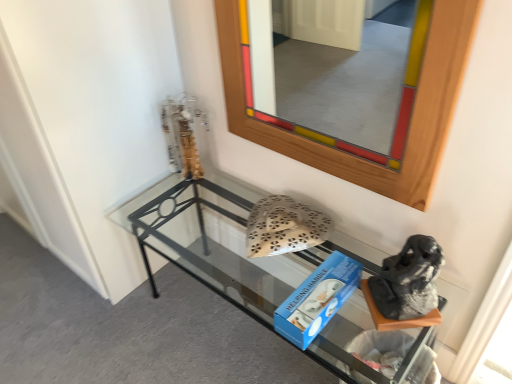
Question: Which is correct: gray fabric boot at lower right is inside metallic gold sculpture at upper left, or outside of it?

Choices:
 (A) outside
 (B) inside

Answer: (A)

Question: From a real-world perspective, relative to metallic gold sculpture at upper left, is gray fabric boot at lower right vertically above or below?

Choices:
 (A) above
 (B) below

Answer: (B)

Question: Based on their relative distances, which object is farther from the clear glass shelf at lower center?

Choices:
 (A) metallic gold sculpture at upper left
 (B) gray fabric boot at lower right
 (C) wooden frame at upper center

Answer: (C)

Question: Which of these objects is positioned closest to the wooden frame at upper center?

Choices:
 (A) clear glass shelf at lower center
 (B) metallic gold sculpture at upper left
 (C) gray fabric boot at lower right

Answer: (A)